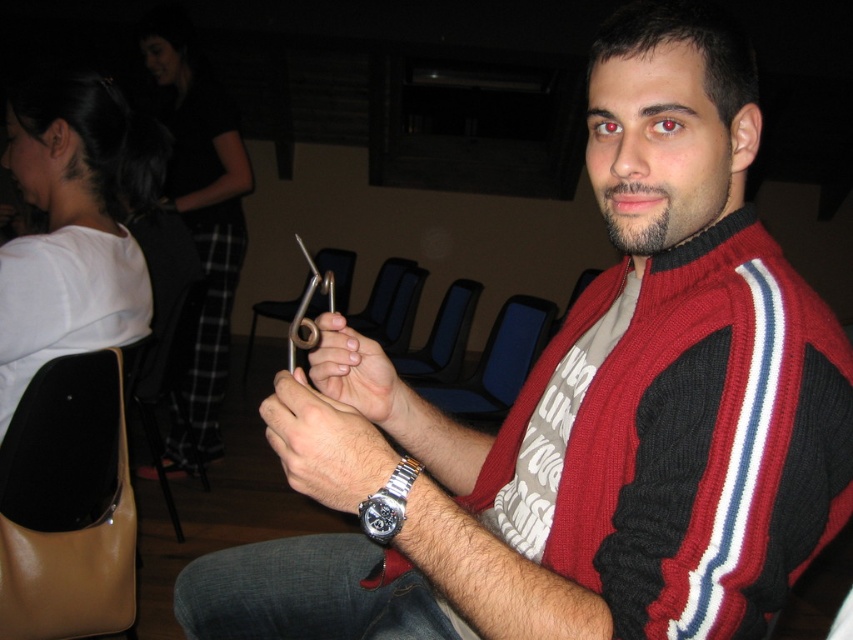
Is point (345, 444) more distant than point (339, 392)?

No, it is not.

Does metallic silver watch at center lie in front of smooth metallic scissors at center?

That is True.

Which is behind, point (374, 444) or point (329, 356)?

Positioned behind is point (329, 356).

Where is `metallic silver watch at center`? The image size is (853, 640). metallic silver watch at center is located at coordinates (323, 444).

Which of these two, metallic silver watch at center or black plastic chair at center, stands shorter?

metallic silver watch at center is shorter.

Which is in front, point (299, 371) or point (457, 292)?

Positioned in front is point (299, 371).

At what (x,y) coordinates should I click in order to perform the action: click on metallic silver watch at center. Please return your answer as a coordinate pair (x, y). Looking at the image, I should click on (323, 444).

Measure the distance between point (368, 461) and camera.

23.15 inches

Is metallic silver watch at center positioned at the back of blue fabric chair at center?

That is False.

Is point (358, 465) closer to camera compared to point (511, 401)?

Yes.

What are the coordinates of `metallic silver watch at center` in the screenshot? It's located at (323, 444).